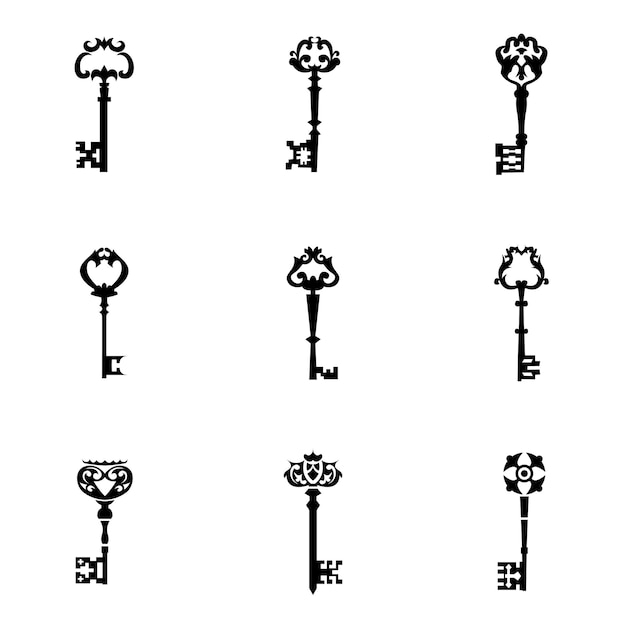
Identify the location of keys. This screenshot has width=626, height=626. (91, 158), (313, 145), (513, 155), (526, 377), (325, 376), (109, 351), (105, 565), (322, 577), (521, 571).